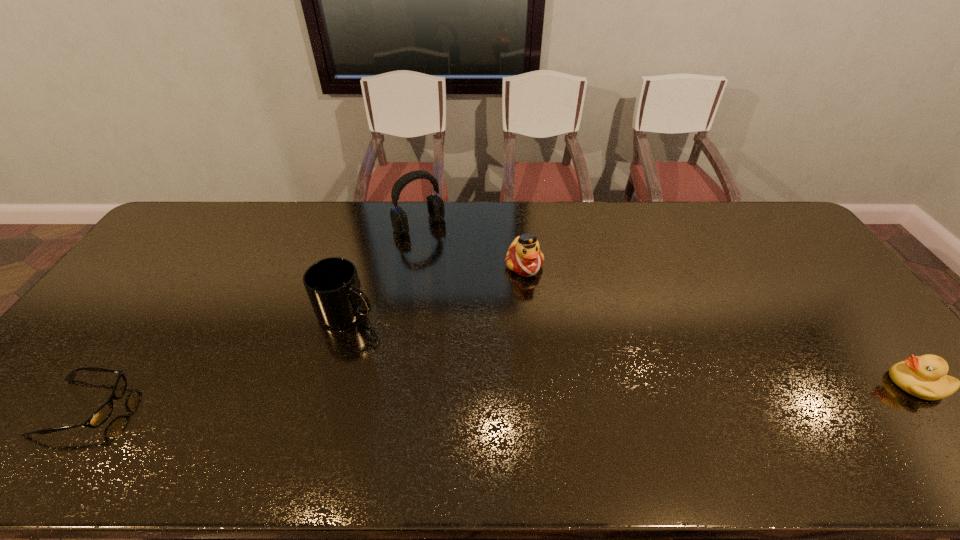
At what (x,y) coordinates should I click in order to perform the action: click on free space on the desktop that is between the spectacles and the rightmost object and is positioned on the face of the fourth nearest object. Please return your answer as a coordinate pair (x, y). The width and height of the screenshot is (960, 540). Looking at the image, I should click on click(603, 393).

Image resolution: width=960 pixels, height=540 pixels. I want to click on free spot on the desktop that is between the shortest object and the rightmost object and is positioned with the handle on the side of the mug, so click(456, 397).

Where is `vacant space on the desktop that is between the leftmost object and the rightmost object and is positioned on the headband of the farthest object`? This screenshot has width=960, height=540. vacant space on the desktop that is between the leftmost object and the rightmost object and is positioned on the headband of the farthest object is located at coordinates (575, 394).